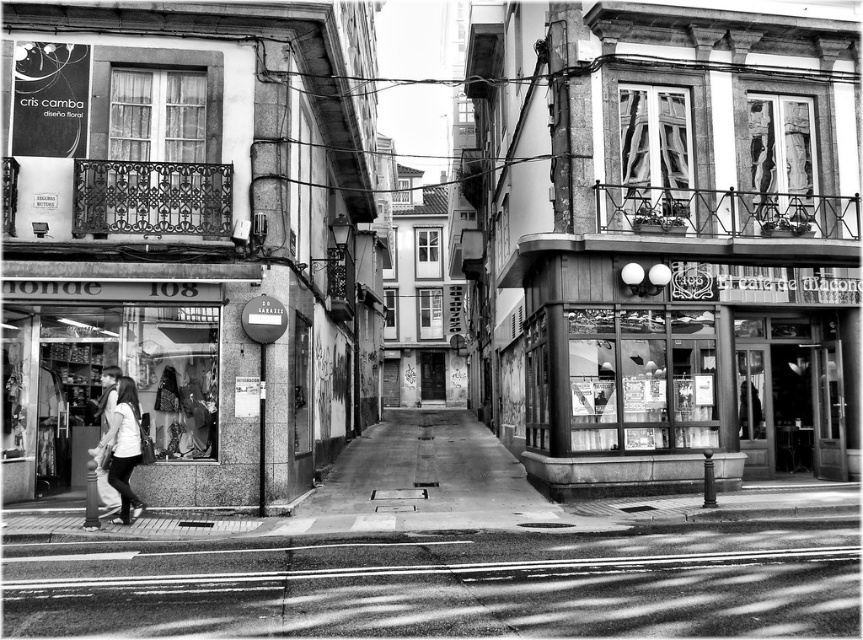
Between smooth concrete pavement at lower center and glass storefront at center, which one appears on the left side from the viewer's perspective?

Positioned to the left is glass storefront at center.

Does smooth concrete pavement at lower center have a lesser height compared to glass storefront at center?

Yes.

Locate an element on the screen. The image size is (863, 640). smooth concrete pavement at lower center is located at coordinates (446, 582).

How distant is glass storefront at center from smooth concrete pavement at center?

4.20 meters

Which is in front, point (701, 356) or point (400, 493)?

Positioned in front is point (701, 356).

Does point (795, 301) come closer to viewer compared to point (335, 461)?

Yes.

You are a GUI agent. You are given a task and a screenshot of the screen. Output one action in this format:
    pyautogui.click(x=<x>, y=<y>)
    Task: Click on the glass storefront at center
    
    Given the screenshot: What is the action you would take?
    pyautogui.click(x=665, y=355)

Does glass storefront at center appear on the left side of smooth white shirt at lower left?

No, glass storefront at center is not to the left of smooth white shirt at lower left.

Is glass storefront at center wider than smooth white shirt at lower left?

Yes, glass storefront at center is wider than smooth white shirt at lower left.

Is point (702, 412) positioned after point (98, 465)?

Yes, point (702, 412) is behind point (98, 465).

Identify the location of glass storefront at center. (665, 355).